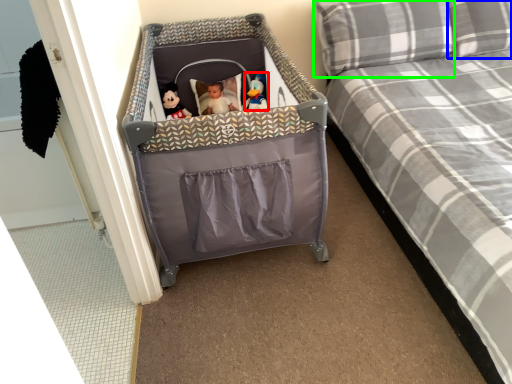
Question: Which object is positioned closest to toy (highlighted by a red box)? Select from pillow (highlighted by a blue box) and pillow (highlighted by a green box).

Choices:
 (A) pillow
 (B) pillow

Answer: (B)